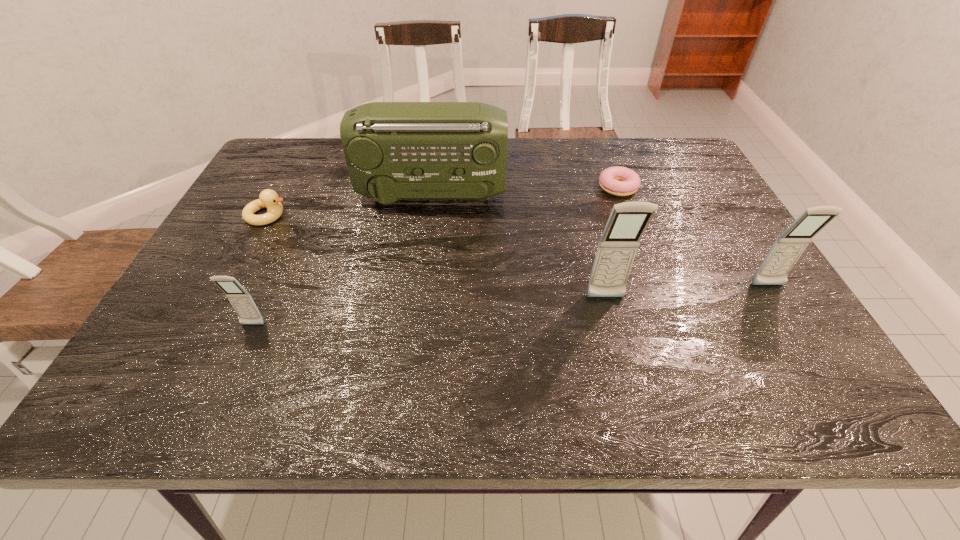
You are a GUI agent. You are given a task and a screenshot of the screen. Output one action in this format:
    pyautogui.click(x=<x>, y=<y>)
    Task: Click on the fifth tallest object
    
    Given the screenshot: What is the action you would take?
    coord(268,198)

Where is `free space located 0.060m on the front-facing side of the second object from left to right`? free space located 0.060m on the front-facing side of the second object from left to right is located at coordinates (240, 354).

Locate an element on the screen. vacant area situated 0.060m on the front-facing side of the second cellular telephone from left to right is located at coordinates point(613,327).

Where is `free spot located on the front-facing side of the second shortest cellular telephone`? This screenshot has width=960, height=540. free spot located on the front-facing side of the second shortest cellular telephone is located at coordinates (802, 340).

The image size is (960, 540). Find the location of `vacant space located on the left of the fifth object from left to right`. vacant space located on the left of the fifth object from left to right is located at coordinates (564, 187).

Find the location of `free space located 0.340m on the front-facing side of the radio_receiver`. free space located 0.340m on the front-facing side of the radio_receiver is located at coordinates (629, 194).

Where is `free space located 0.240m at the beak of the leftmost object`? Image resolution: width=960 pixels, height=540 pixels. free space located 0.240m at the beak of the leftmost object is located at coordinates (382, 215).

Where is `doughnut at the far edge`? doughnut at the far edge is located at coordinates (619, 181).

Find the location of a particular element. The image size is (960, 540). radio_receiver that is positioned at the far edge is located at coordinates (394, 151).

This screenshot has width=960, height=540. I want to click on object that is at the near edge, so coord(242,302).